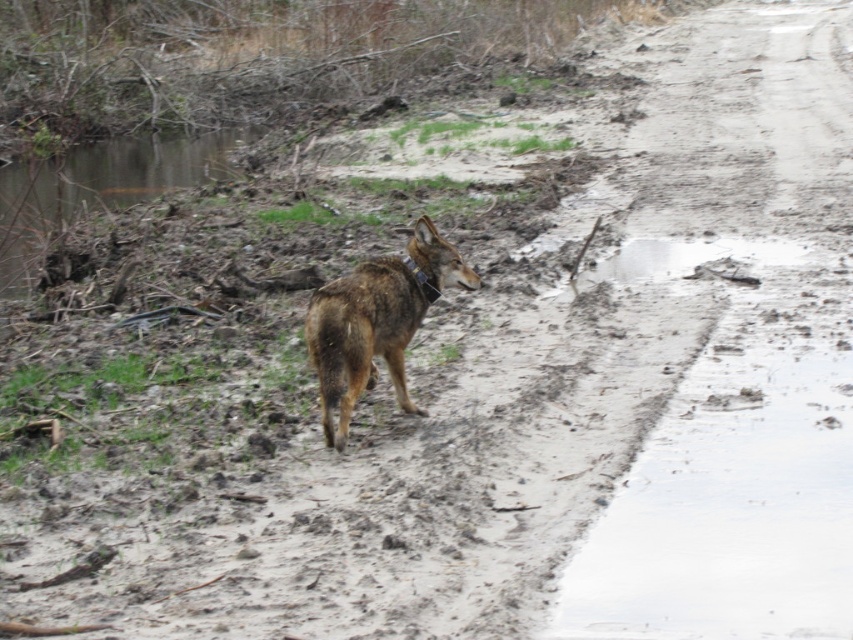
You are an animal tracker observing a coyote in a natural setting. You notice the brown fur dog at center and the brown muddy water at upper left. Which object is positioned lower in the image?

The brown fur dog at center is positioned below brown muddy water at upper left, so the brown fur dog at center is lower in the image.

You are a hiker who wants to cross the brown muddy water at upper left to reach the brown fur dog at center. Which direction should you move to get closer to the dog?

The brown fur dog at center is to the right of the brown muddy water at upper left, so you should move to the right to get closer to the dog.